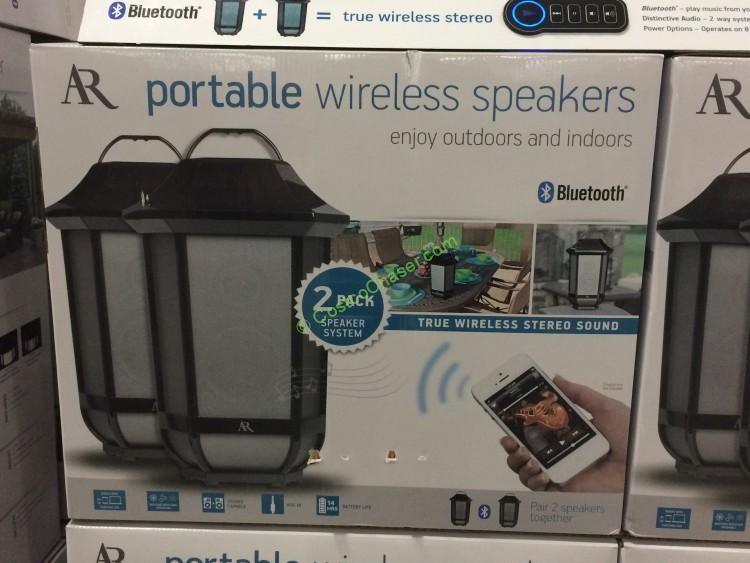
Image resolution: width=750 pixels, height=563 pixels. In order to click on shelf display in this screenshot , I will do `click(465, 30)`.